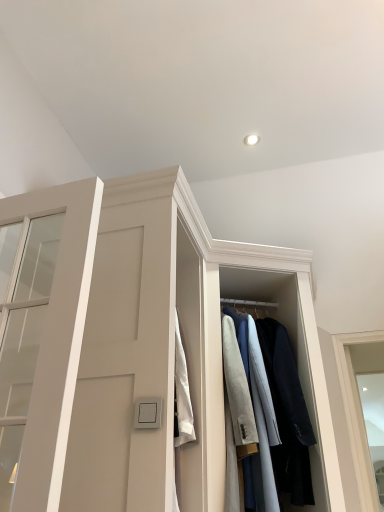
Question: Is white matte door at left bigger or smaller than light gray wool coat at center?

Choices:
 (A) big
 (B) small

Answer: (B)

Question: Is point (79, 289) closer or farther from the camera than point (294, 467)?

Choices:
 (A) closer
 (B) farther

Answer: (A)

Question: From the image's perspective, relative to light gray wool coat at center, is white matte door at left above or below?

Choices:
 (A) above
 (B) below

Answer: (A)

Question: In terms of width, does light gray wool coat at center look wider or thinner when compared to white matte door at left?

Choices:
 (A) thin
 (B) wide

Answer: (B)

Question: Is point (261, 359) closer or farther from the camera than point (51, 468)?

Choices:
 (A) closer
 (B) farther

Answer: (B)

Question: From the image's perspective, is light gray wool coat at center positioned above or below white matte door at left?

Choices:
 (A) above
 (B) below

Answer: (B)

Question: Would you say light gray wool coat at center is inside or outside white matte door at left?

Choices:
 (A) inside
 (B) outside

Answer: (B)